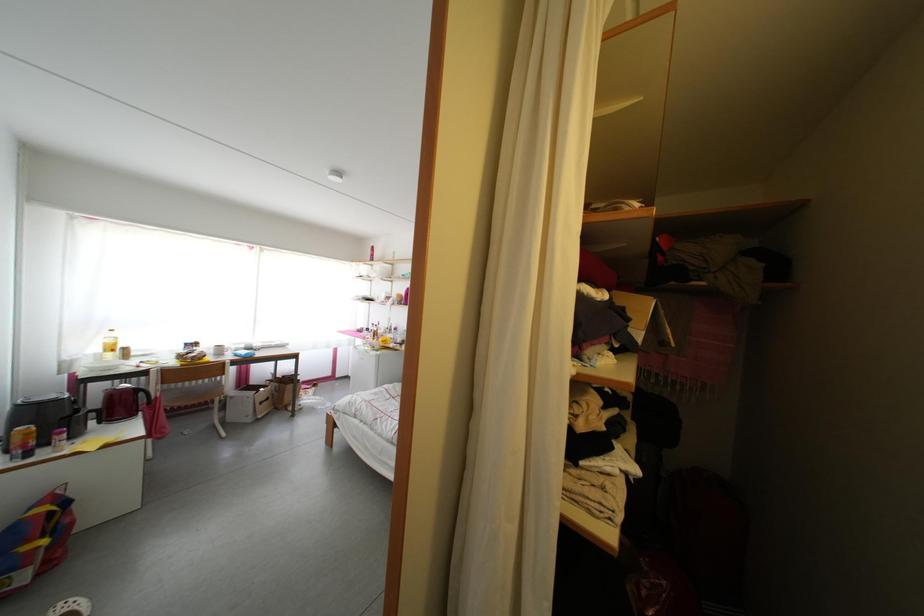
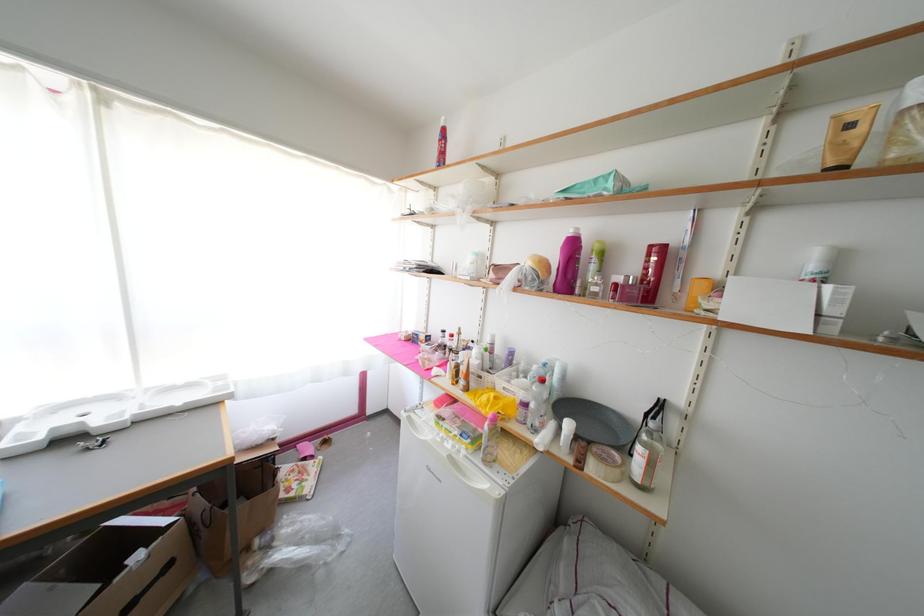
In a continuous first-person perspective shot, in which direction is the camera moving?

The cameraman moved toward left, forward.